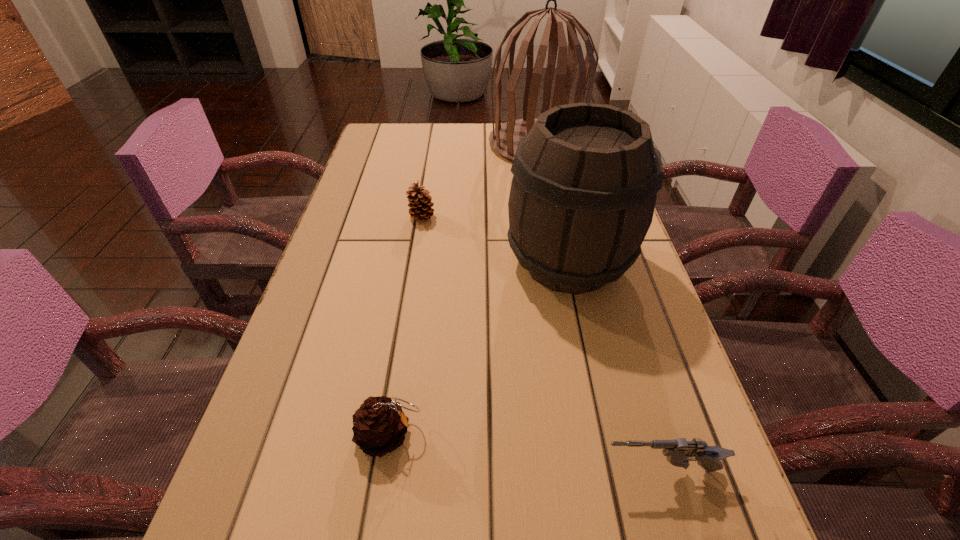
Select which object appears as the third closest to the fourth farthest object. Please provide its 2D coordinates. Your answer should be formatted as a tuple, i.e. [(x, y)], where the tuple contains the x and y coordinates of a point satisfying the conditions above.

[(420, 204)]

Where is `object that is the third closest to the fourth farthest object`? This screenshot has width=960, height=540. object that is the third closest to the fourth farthest object is located at coordinates (420, 204).

The image size is (960, 540). In order to click on blank space that satisfies the following two spatial constraints: 1. on the front side of the wine bucket; 2. with a leaf charm attached to the second nearest object in this screenshot , I will do `click(606, 435)`.

Identify the location of blank space that satisfies the following two spatial constraints: 1. on the back side of the farther pinecone; 2. on the right side of the farthest object. (434, 144).